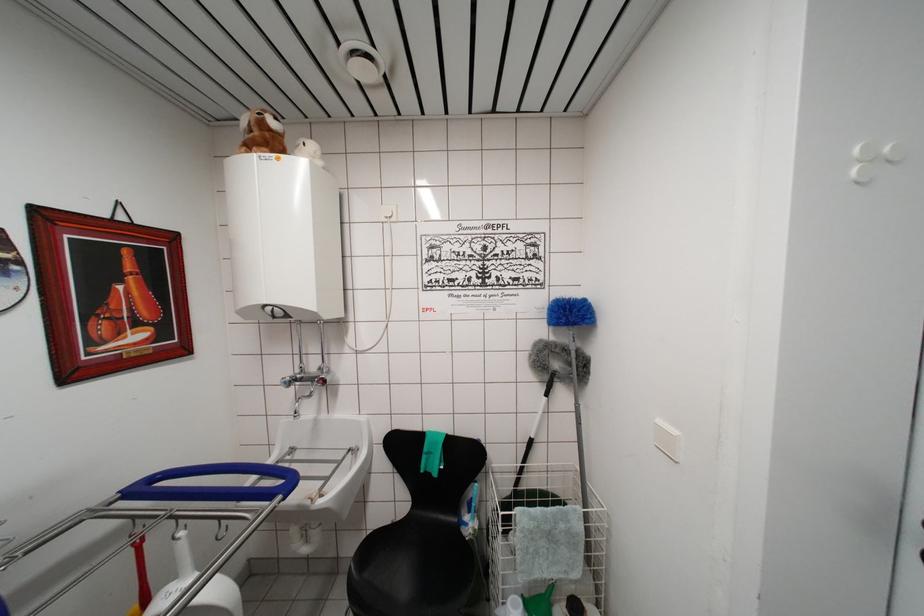
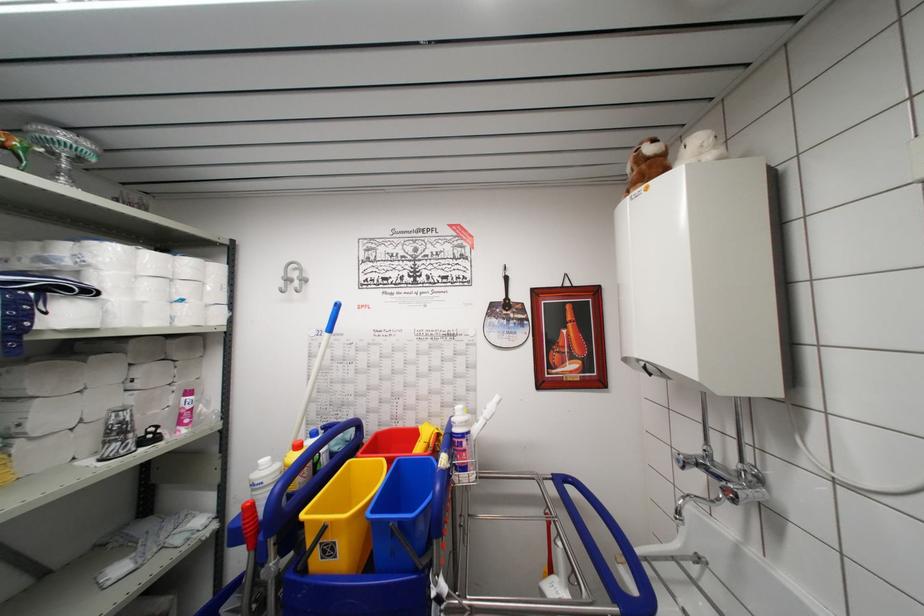
Question: The images are taken continuously from a first-person perspective. In which direction is your viewpoint rotating?

Choices:
 (A) Left
 (B) Right
 (C) Up
 (D) Down

Answer: (A)